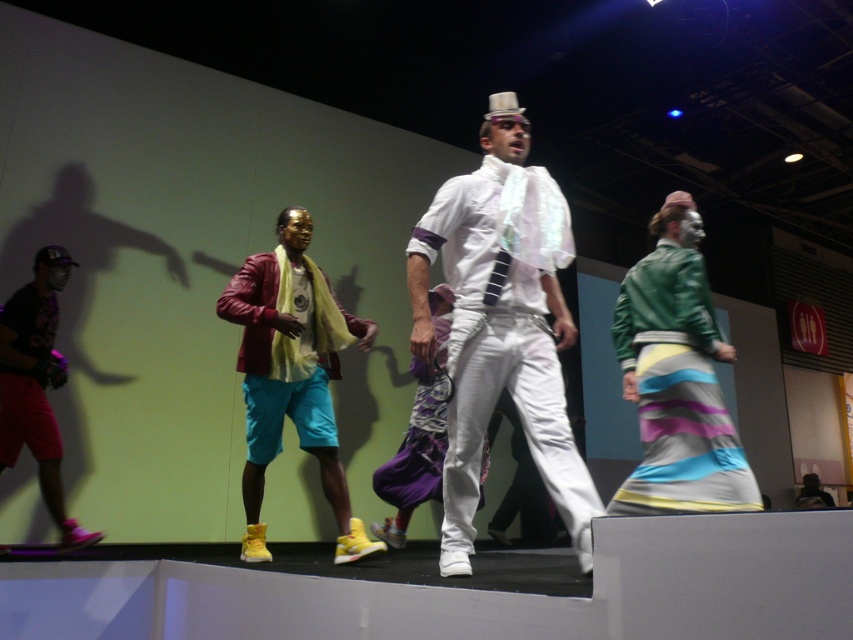
Who is higher up, green leather jacket at right or brushed metal baseball cap at left?

green leather jacket at right is above.

Between green leather jacket at right and brushed metal baseball cap at left, which one appears on the left side from the viewer's perspective?

From the viewer's perspective, brushed metal baseball cap at left appears more on the left side.

Is point (614, 321) positioned after point (67, 275)?

No, it is in front of (67, 275).

Where is `green leather jacket at right`? The width and height of the screenshot is (853, 640). green leather jacket at right is located at coordinates (677, 378).

Can you confirm if matte leather jacket at center is wider than brushed metal baseball cap at left?

Yes, matte leather jacket at center is wider than brushed metal baseball cap at left.

Is matte leather jacket at center positioned behind brushed metal baseball cap at left?

That is False.

Is point (288, 385) closer to camera compared to point (1, 400)?

Yes, it is.

The width and height of the screenshot is (853, 640). Find the location of `matte leather jacket at center`. matte leather jacket at center is located at coordinates (292, 374).

Between point (463, 253) and point (317, 385), which one is positioned behind?

The point (317, 385) is behind.

Is white satin shirt at center positioned behind matte leather jacket at center?

That is False.

Does point (569, 317) come farther from viewer compared to point (288, 342)?

No, (569, 317) is closer to viewer.

You are a GUI agent. You are given a task and a screenshot of the screen. Output one action in this format:
    pyautogui.click(x=<x>, y=<y>)
    Task: Click on the white satin shirt at center
    The width and height of the screenshot is (853, 640).
    Given the screenshot: What is the action you would take?
    pyautogui.click(x=502, y=324)